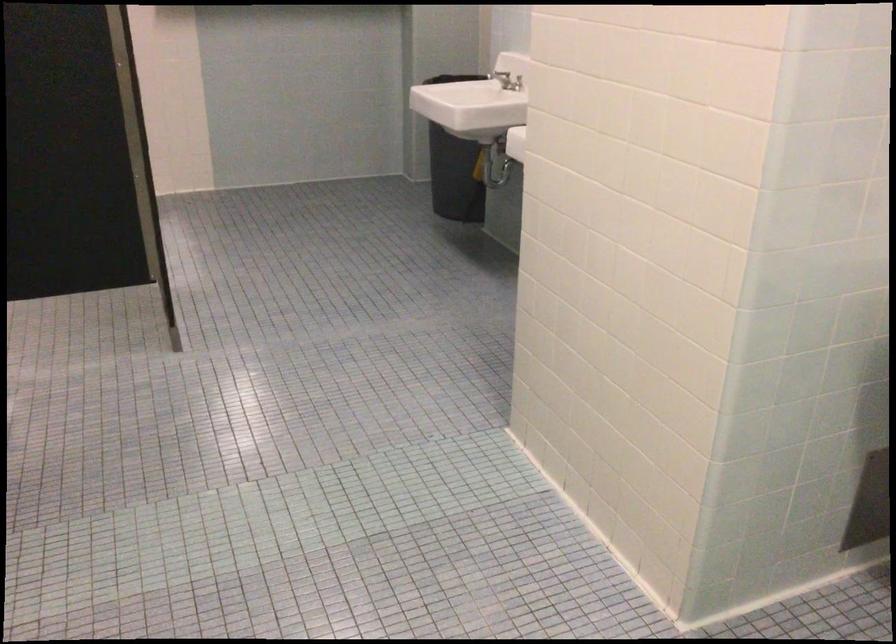
Describe the element at coordinates (500, 75) in the screenshot. I see `a metal faucet handle` at that location.